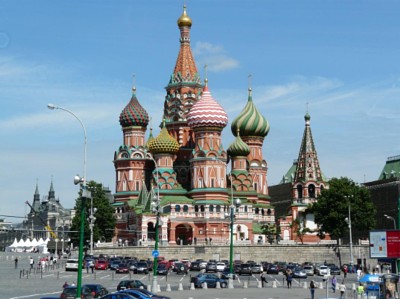
Locate an element on the screen. The image size is (400, 299). light is located at coordinates (72, 176), (49, 100), (341, 212).